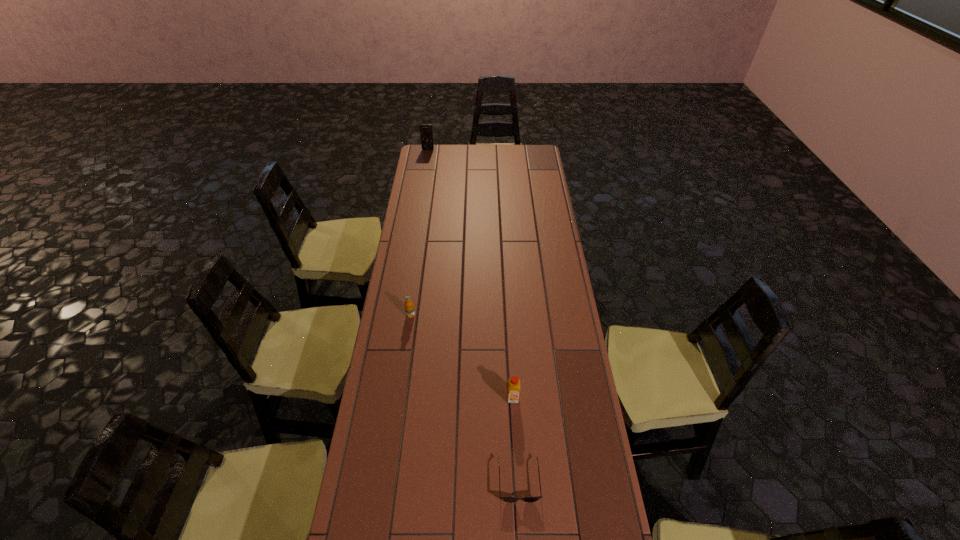
Find the location of a particular element. cellular telephone is located at coordinates click(x=426, y=133).

You are a GUI agent. You are given a task and a screenshot of the screen. Output one action in this format:
    pyautogui.click(x=<x>, y=<y>)
    Task: Click on the tallest object
    The width and height of the screenshot is (960, 540).
    Given the screenshot: What is the action you would take?
    pyautogui.click(x=426, y=133)

You are a GUI agent. You are given a task and a screenshot of the screen. Output one action in this format:
    pyautogui.click(x=<x>, y=<y>)
    Task: Click on the second nearest object
    This screenshot has width=960, height=540.
    Given the screenshot: What is the action you would take?
    pyautogui.click(x=514, y=383)

The width and height of the screenshot is (960, 540). What are the coordinates of `the nearer orange juice` in the screenshot? It's located at (514, 383).

Locate an element on the screen. the farther orange juice is located at coordinates (409, 307).

Find the location of a particular element. The height and width of the screenshot is (540, 960). the second farthest object is located at coordinates (409, 307).

The height and width of the screenshot is (540, 960). I want to click on sunglasses, so click(x=507, y=499).

The height and width of the screenshot is (540, 960). I want to click on the nearest object, so click(x=507, y=499).

Identify the location of vacant position located 0.260m on the screen of the cellular telephone. pyautogui.click(x=424, y=174).

Locate an element on the screen. Image resolution: width=960 pixels, height=540 pixels. vacant space located on the front and back of the nearer orange juice is located at coordinates (516, 448).